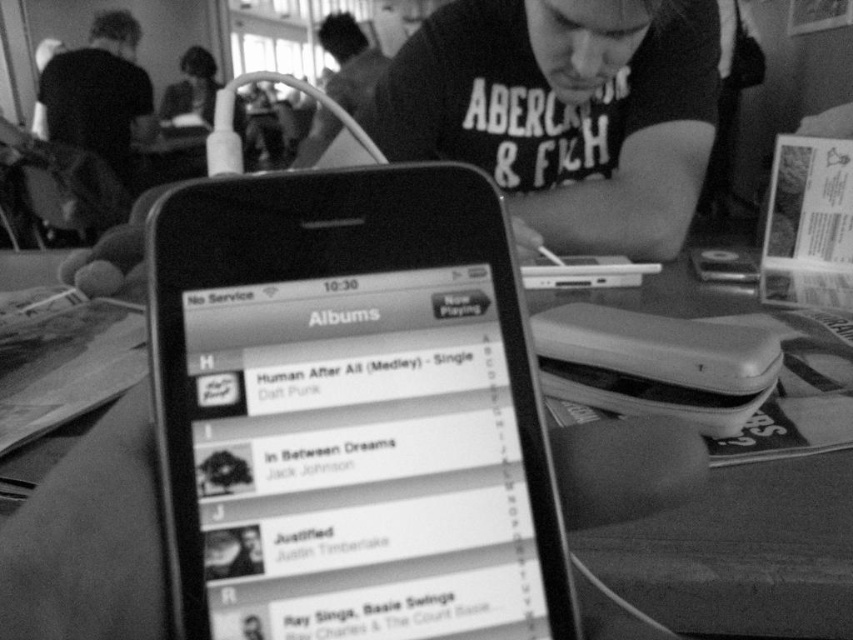
Which is behind, point (825, 483) or point (633, 310)?

The point (633, 310) is more distant.

Is smooth plastic phone at center bigger than smooth black phone at center?

Indeed, smooth plastic phone at center has a larger size compared to smooth black phone at center.

The height and width of the screenshot is (640, 853). What do you see at coordinates (746, 492) in the screenshot? I see `smooth plastic phone at center` at bounding box center [746, 492].

At what (x,y) coordinates should I click in order to perform the action: click on smooth plastic phone at center. Please return your answer as a coordinate pair (x, y). The width and height of the screenshot is (853, 640). Looking at the image, I should click on (746, 492).

The height and width of the screenshot is (640, 853). Identify the location of smooth glossy phone at center. point(349,412).

Between point (195, 579) and point (834, 572), which one is positioned in front?

Point (195, 579)

At what (x,y) coordinates should I click in order to perform the action: click on smooth glossy phone at center. Please return your answer as a coordinate pair (x, y). This screenshot has width=853, height=640. Looking at the image, I should click on (349, 412).

Is smooth glossy phone at center to the left of smooth black phone at center from the viewer's perspective?

Yes, smooth glossy phone at center is to the left of smooth black phone at center.

Between point (300, 177) and point (567, 378), which one is positioned behind?

Positioned behind is point (567, 378).

You are a GUI agent. You are given a task and a screenshot of the screen. Output one action in this format:
    pyautogui.click(x=<x>, y=<y>)
    Task: Click on the smooth glossy phone at center
    This screenshot has width=853, height=640.
    Given the screenshot: What is the action you would take?
    pyautogui.click(x=349, y=412)